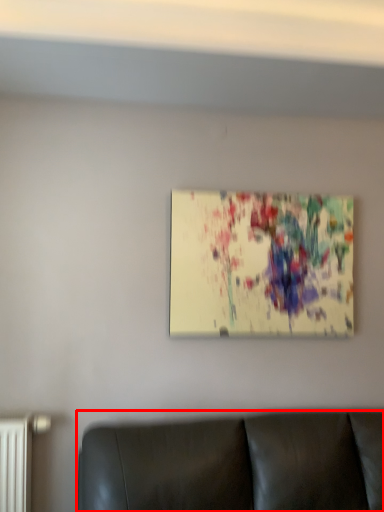
Question: From the image's perspective, what is the correct spatial relationship of furniture (annotated by the red box) in relation to picture frame?

Choices:
 (A) above
 (B) below

Answer: (B)